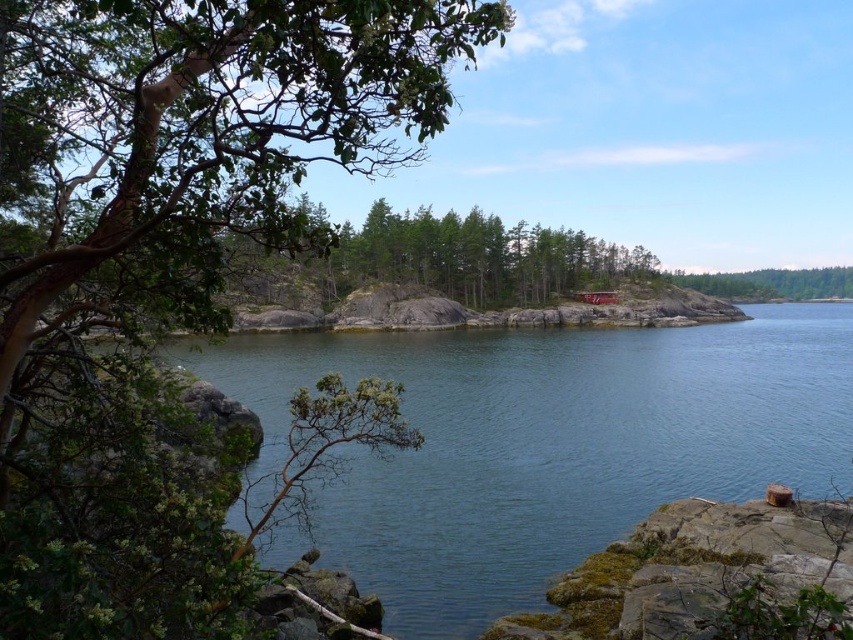
Question: Among these points, which one is farthest from the camera?

Choices:
 (A) (465, 349)
 (B) (839, 273)

Answer: (B)

Question: Does green leafy tree at left appear on the right side of green leafy tree at right?

Choices:
 (A) no
 (B) yes

Answer: (A)

Question: Does green leafy tree at left appear over green leafy tree at right?

Choices:
 (A) no
 (B) yes

Answer: (A)

Question: Can you confirm if green leafy tree at left is thinner than green leafy tree at right?

Choices:
 (A) yes
 (B) no

Answer: (A)

Question: Which object is positioned closest to the green leafy tree at right?

Choices:
 (A) green leafy tree at left
 (B) clear water at center

Answer: (B)

Question: Which of these objects is positioned farthest from the green leafy tree at left?

Choices:
 (A) green leafy tree at right
 (B) clear water at center

Answer: (A)